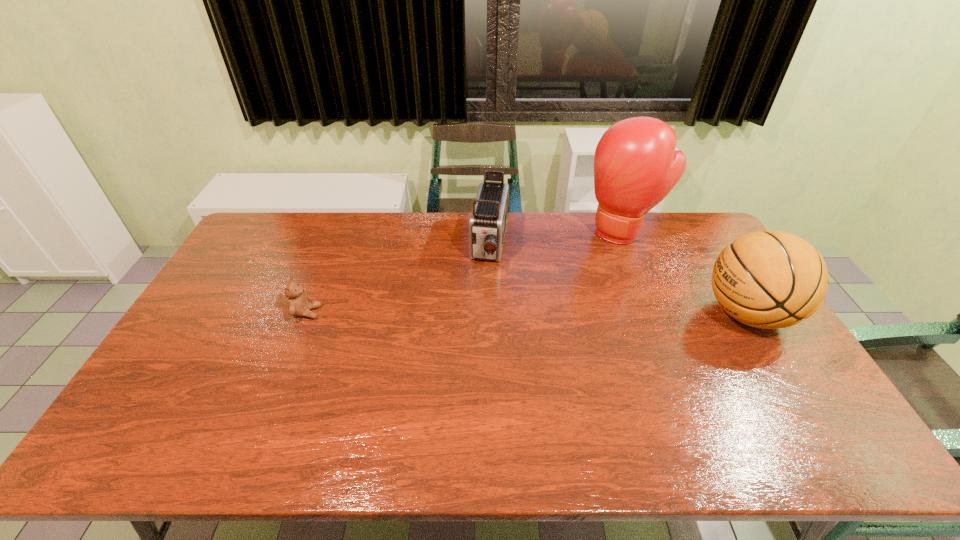
The image size is (960, 540). Identify the location of blank region between the tallest object and the teddy bear. (465, 272).

Where is `vacant space that is in between the camcorder and the teddy bear`? The height and width of the screenshot is (540, 960). vacant space that is in between the camcorder and the teddy bear is located at coordinates (398, 278).

Image resolution: width=960 pixels, height=540 pixels. Find the location of `unoccupied position between the basketball and the leftmost object`. unoccupied position between the basketball and the leftmost object is located at coordinates (527, 313).

Locate an element on the screen. This screenshot has height=540, width=960. object that is the third nearest to the third tallest object is located at coordinates click(771, 279).

Find the location of a particular element. This screenshot has height=540, width=960. object that is the third closest one to the camcorder is located at coordinates [771, 279].

The image size is (960, 540). What are the coordinates of `blank space that satisfies the following two spatial constraints: 1. on the front side of the tallest object; 2. on the surface of the basketball near the brand logo` in the screenshot? It's located at (656, 314).

Find the location of a particular element. Image resolution: width=960 pixels, height=540 pixels. free space that satisfies the following two spatial constraints: 1. on the front side of the basketball; 2. on the surface of the camcorder near the brand logo is located at coordinates (492, 314).

At what (x,y) coordinates should I click in order to perform the action: click on vacant region that satisfies the following two spatial constraints: 1. on the back side of the boxing glove; 2. on the right side of the second shortest object. Please return your answer as a coordinate pair (x, y). This screenshot has width=960, height=540. Looking at the image, I should click on (490, 232).

Locate an element on the screen. vacant point that satisfies the following two spatial constraints: 1. on the front side of the boxing glove; 2. on the surface of the basketball near the brand logo is located at coordinates (656, 314).

Identify the location of vacant point that satisfies the following two spatial constraints: 1. on the front side of the camcorder; 2. on the surface of the basketball near the brand logo. point(492,314).